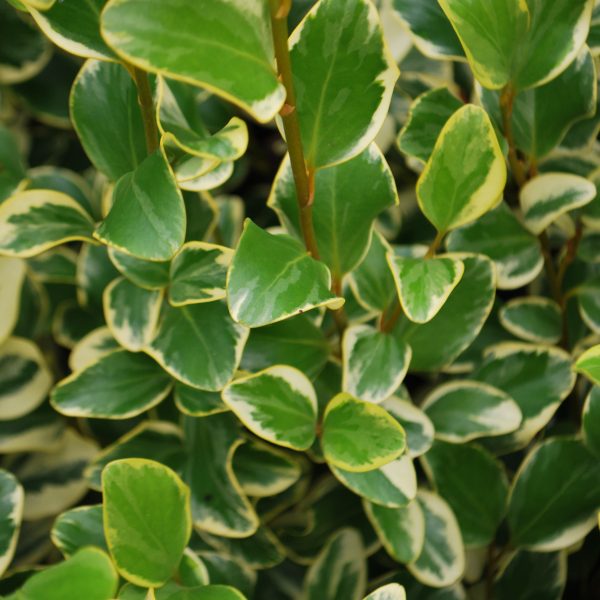
Locate an element on the screen. plant is located at coordinates (313, 353).